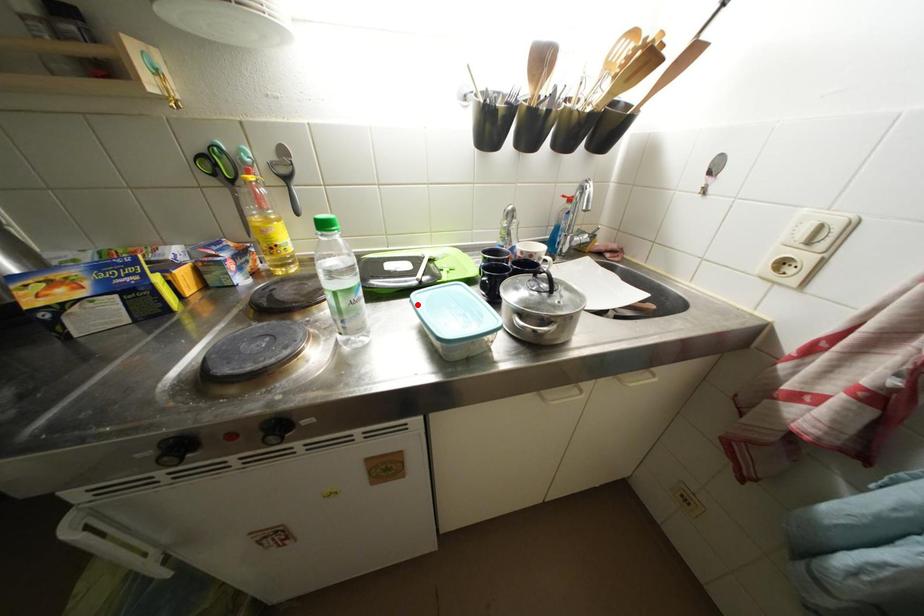
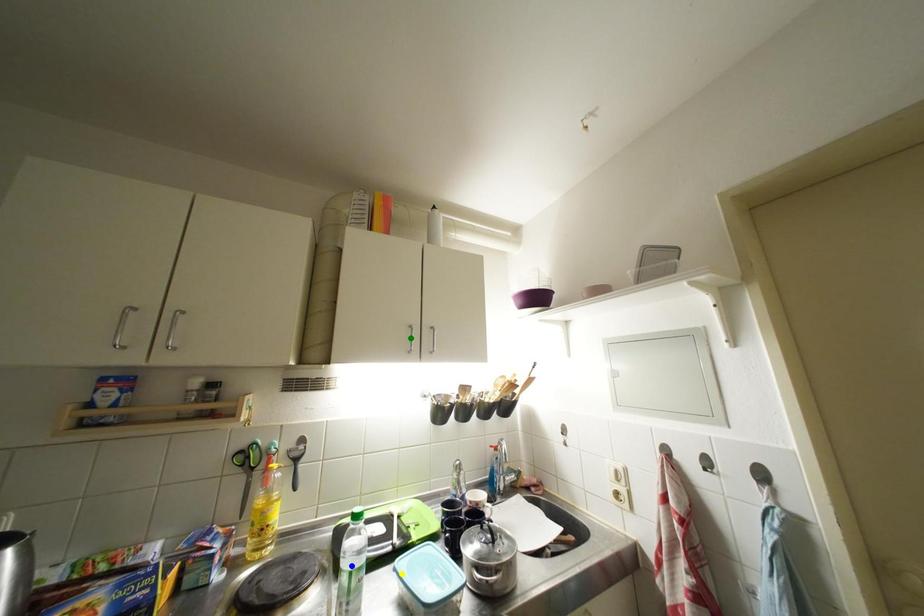
Question: I am providing you with two images of the same scene from different viewpoints. A red point is marked on the first image. You are given multiple points on the second image. Can you choose the point in image 2 that corresponds to the point in image 1?

Choices:
 (A) yellow point
 (B) green point
 (C) blue point

Answer: (A)